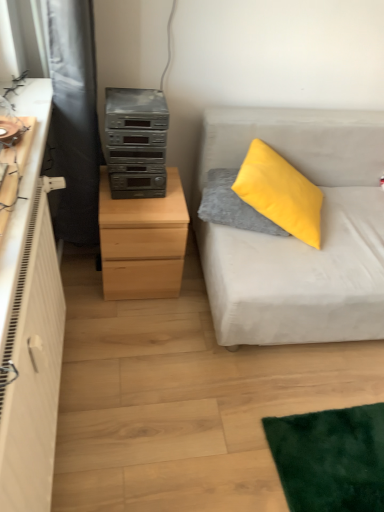
Image resolution: width=384 pixels, height=512 pixels. In order to click on vacant region in front of light wood chest of drawers at left in this screenshot , I will do `click(135, 328)`.